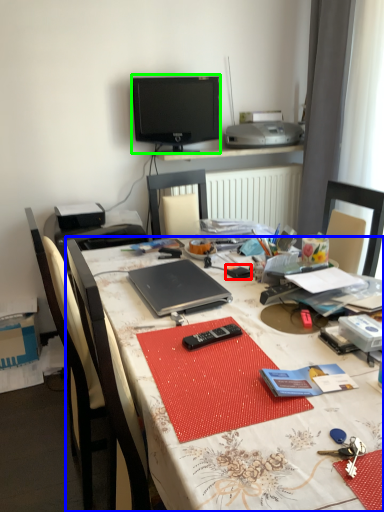
Question: Considering the real-world distances, which object is closest to stationery (highlighted by a red box)? desk (highlighted by a blue box) or television (highlighted by a green box).

Choices:
 (A) desk
 (B) television

Answer: (A)